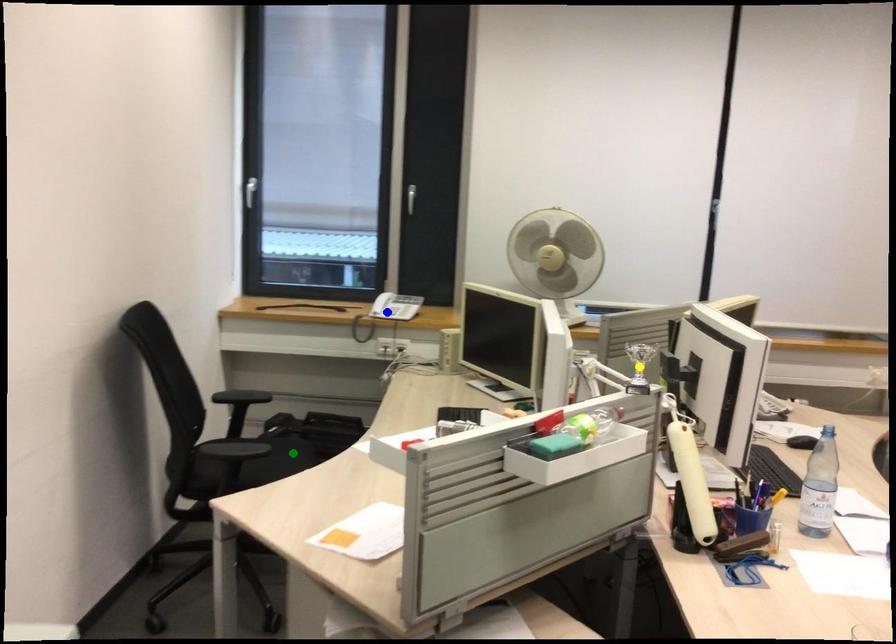
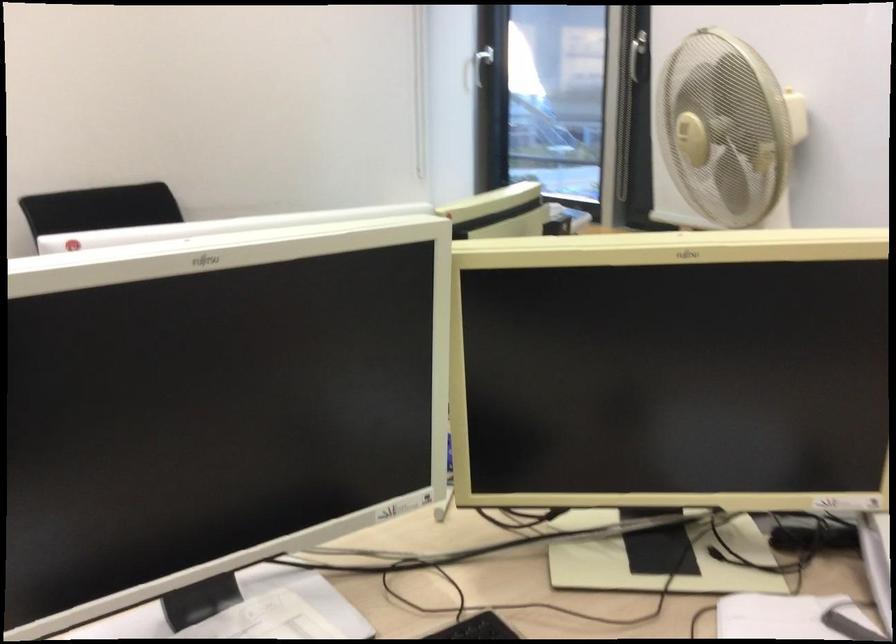
I am providing you with two images of the same scene from different viewpoints. Three points are marked in image1. Which point corresponds to a part or object that is occluded in image2?In image1, three points are marked. Which of them correspond to a part or object that is occluded in image2?Among the three points shown in image1, which one corresponds to a part or object that is no longer visible due to occlusion in image2?

blue point, green point, yellow point cannot be seen in image2.